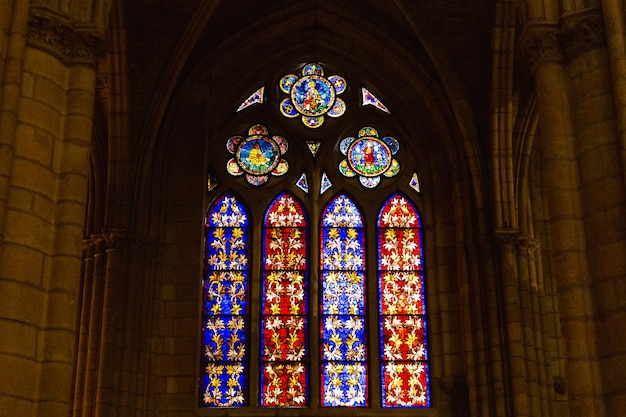
I want to click on long windows, so click(x=337, y=277), click(x=232, y=297), click(x=277, y=285), click(x=409, y=270).